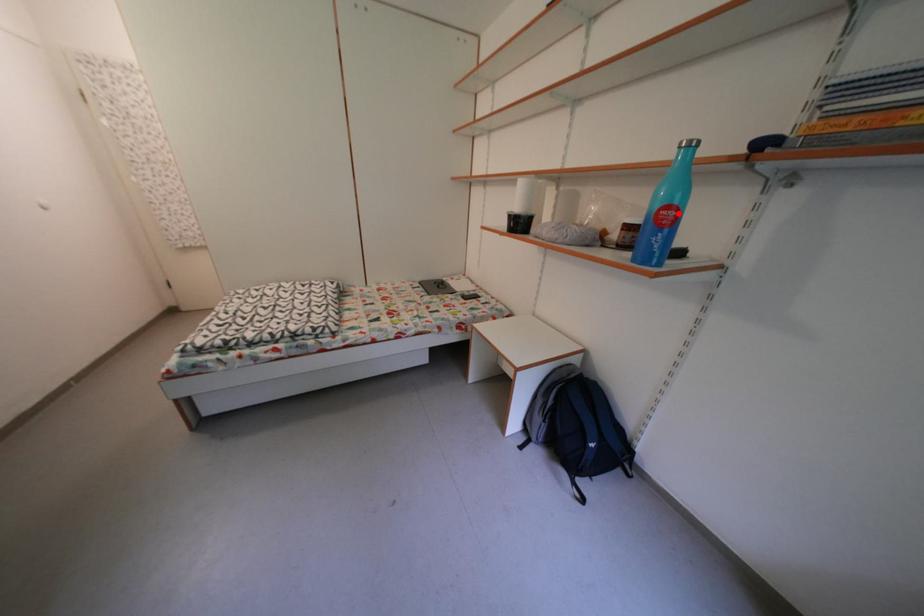
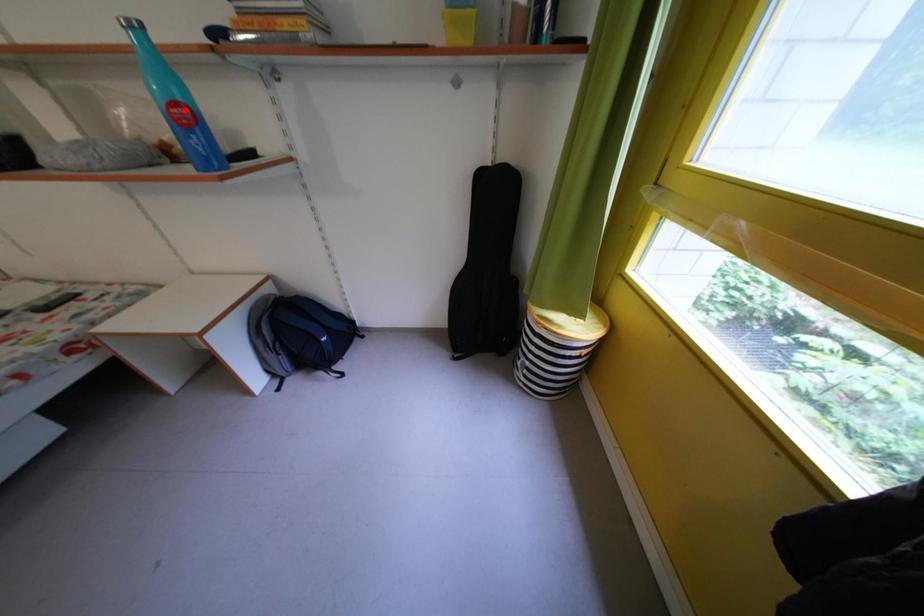
Looking at this image, I am providing you with two images of the same scene from different viewpoints. A red point is marked on the first image and another point is marked on the second image. Is the red point in image1 aligned with the point shown in image2?

Yes